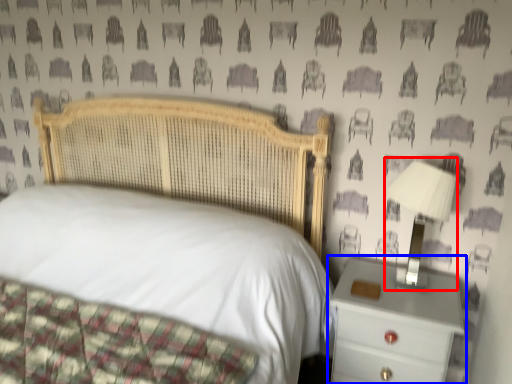
Question: Which point is further to the camera, bedside lamp (highlighted by a red box) or nightstand (highlighted by a blue box)?

Choices:
 (A) bedside lamp
 (B) nightstand

Answer: (A)